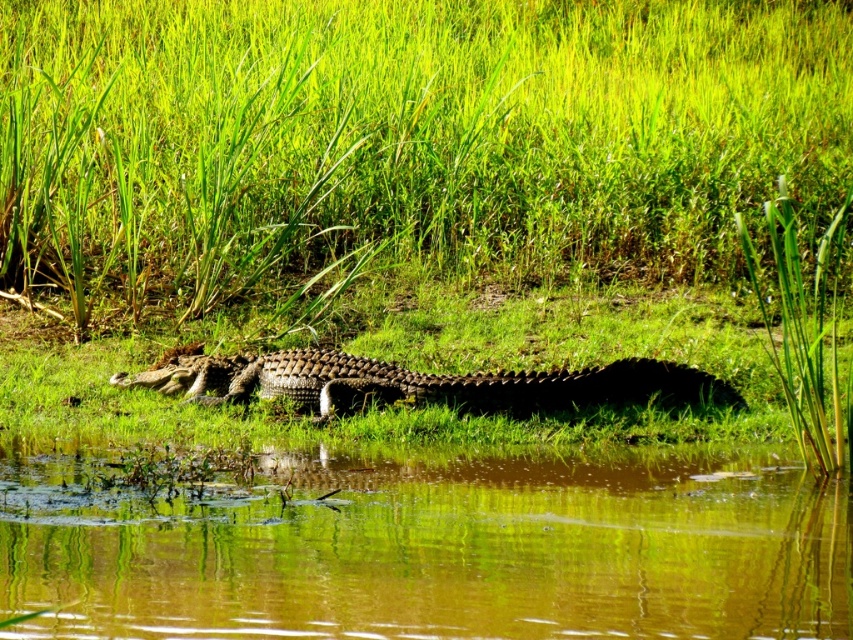
Question: In this image, where is green grass at center located relative to shiny brown crocodile at center?

Choices:
 (A) right
 (B) left

Answer: (B)

Question: Which object is the farthest from the shiny brown crocodile at center?

Choices:
 (A) brown murky water at center
 (B) green grass at center

Answer: (B)

Question: Is green grass at center positioned behind brown murky water at center?

Choices:
 (A) yes
 (B) no

Answer: (A)

Question: Estimate the real-world distances between objects in this image. Which object is farther from the green grass at center?

Choices:
 (A) brown murky water at center
 (B) shiny brown crocodile at center

Answer: (A)

Question: Which object appears closest to the camera in this image?

Choices:
 (A) green grass at center
 (B) brown murky water at center

Answer: (B)

Question: Is the position of brown murky water at center less distant than that of shiny brown crocodile at center?

Choices:
 (A) no
 (B) yes

Answer: (B)